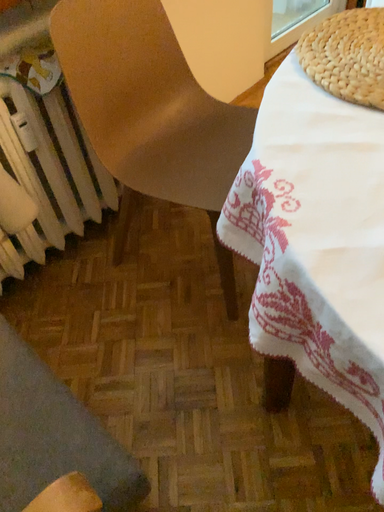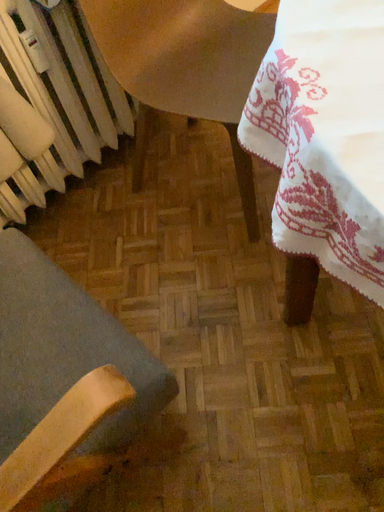
Question: Which way did the camera rotate in the video?

Choices:
 (A) rotated downward
 (B) rotated upward

Answer: (A)